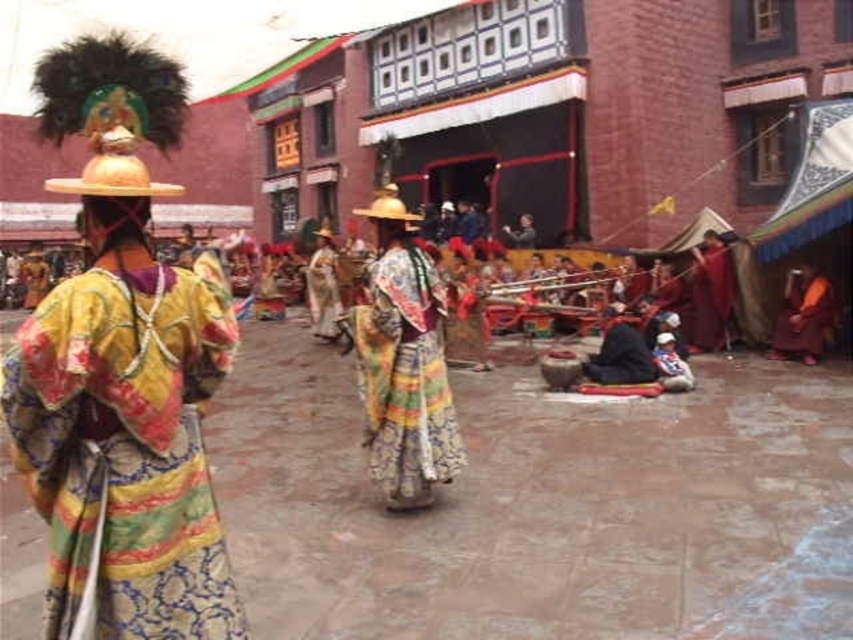
Between multicolored brocade robe at center and multicolored silk dress at center, which one appears on the left side from the viewer's perspective?

From the viewer's perspective, multicolored brocade robe at center appears more on the left side.

Who is taller, multicolored brocade robe at center or multicolored silk dress at center?

Standing taller between the two is multicolored silk dress at center.

Image resolution: width=853 pixels, height=640 pixels. What are the coordinates of `multicolored brocade robe at center` in the screenshot? It's located at (125, 451).